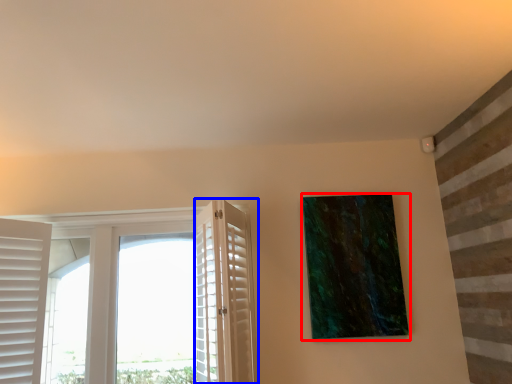
Question: Among these objects, which one is nearest to the camera, picture frame (highlighted by a red box) or screen door (highlighted by a blue box)?

Choices:
 (A) picture frame
 (B) screen door

Answer: (B)